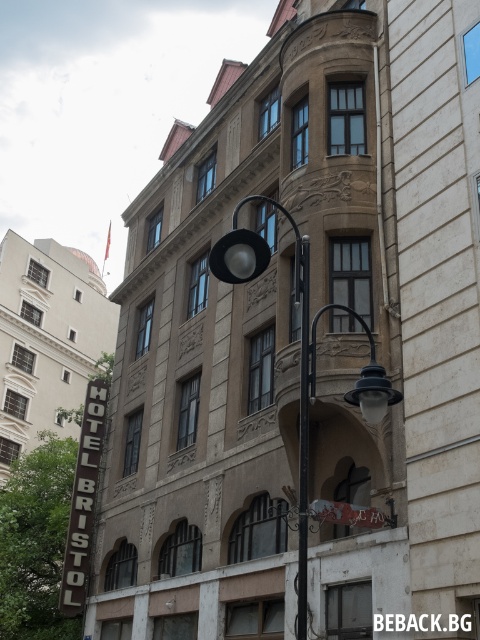
Is black metal pole at center positioned at the back of metallic silver sign at center?

That is False.

Does black metal pole at center appear on the right side of metallic silver sign at center?

In fact, black metal pole at center is to the left of metallic silver sign at center.

Which is behind, point (303, 256) or point (351, 513)?

Positioned behind is point (351, 513).

The width and height of the screenshot is (480, 640). Identify the location of black metal pole at center. (302, 424).

Does matte black lamp post at center have a lesser width compared to metallic silver sign at center?

No.

Looking at this image, is matte black lamp post at center bigger than metallic silver sign at center?

Yes.

Where is `matte black lamp post at center`? The width and height of the screenshot is (480, 640). matte black lamp post at center is located at coordinates (300, 348).

Is matte black lamp post at center closer to camera compared to black metal pole at center?

That is True.

Looking at this image, between matte black lamp post at center and black metal pole at center, which one appears on the left side from the viewer's perspective?

matte black lamp post at center is more to the left.

I want to click on matte black lamp post at center, so click(300, 348).